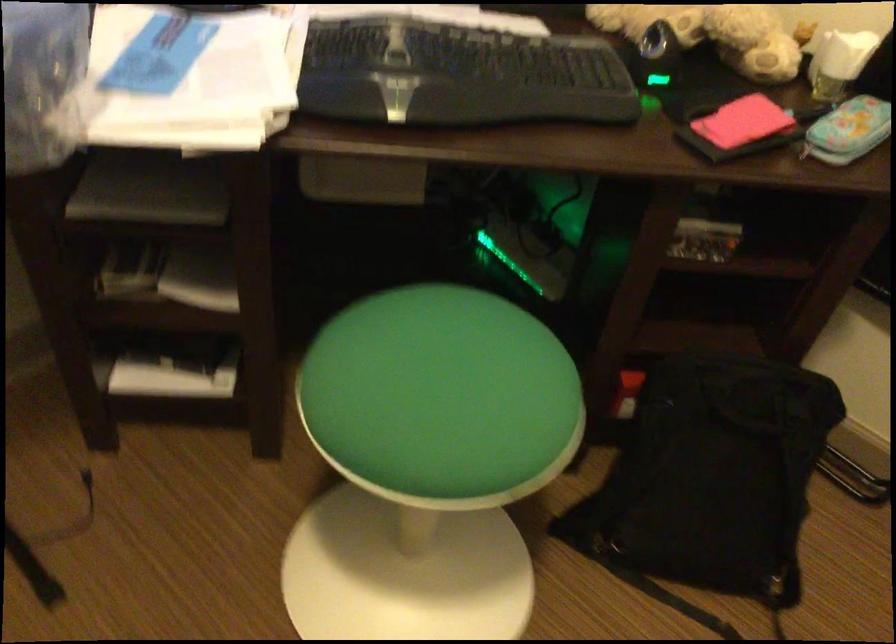
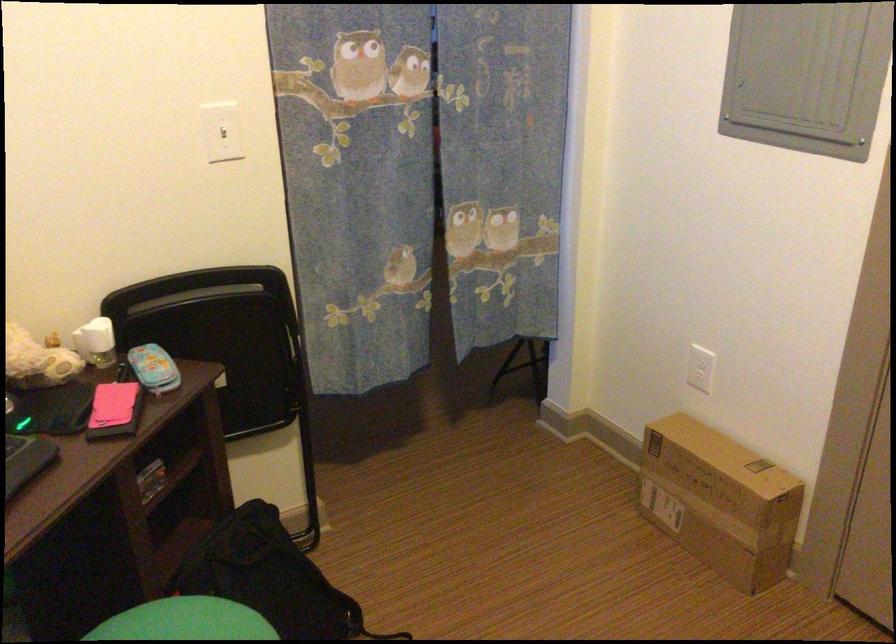
The point at (730, 126) is marked in the first image. Where is the corresponding point in the second image?

(114, 410)